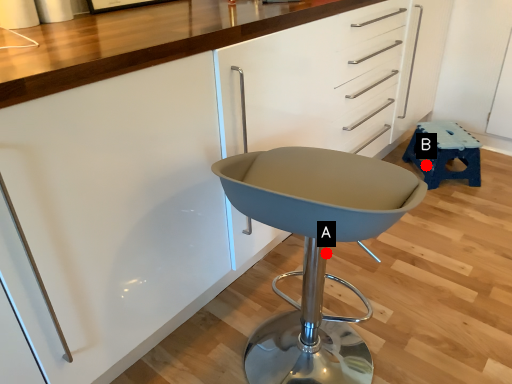
Question: Two points are circled on the image, labeled by A and B beside each circle. Which of the following is the farthest from the observer?

Choices:
 (A) A is further
 (B) B is further

Answer: (B)